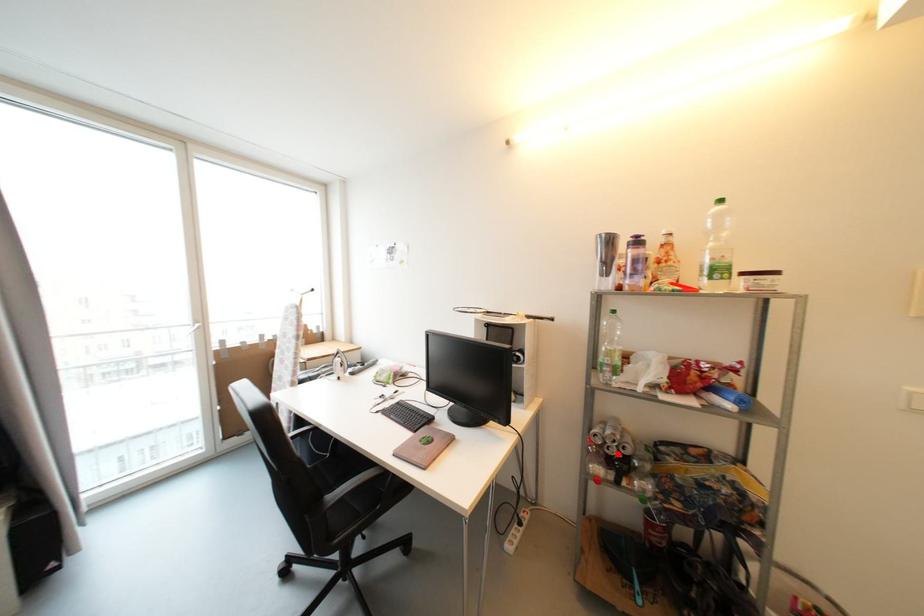
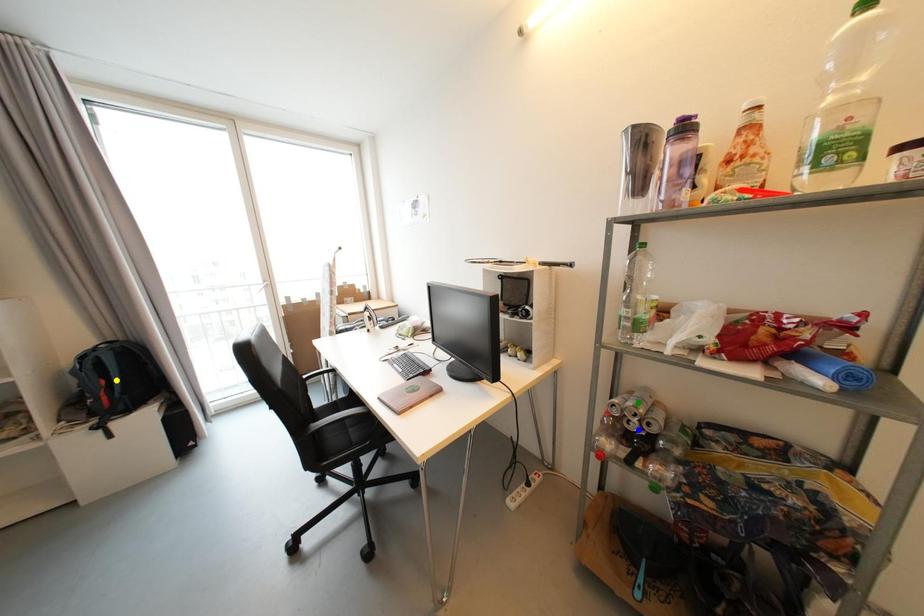
Question: I am providing you with two images of the same scene from different viewpoints. A red point is marked on the first image. You are given multiple points on the second image. Which point in image 2 represents the same 3d spot as the red point in image 1?

Choices:
 (A) green point
 (B) yellow point
 (C) blue point

Answer: (C)